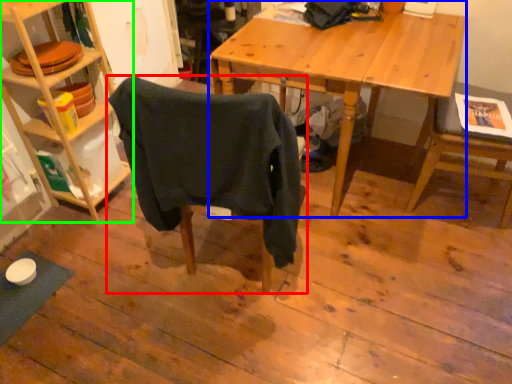
Question: Which object is positioned farthest from chair (highlighted by a red box)? Select from desk (highlighted by a blue box) and shelf (highlighted by a green box).

Choices:
 (A) desk
 (B) shelf

Answer: (B)